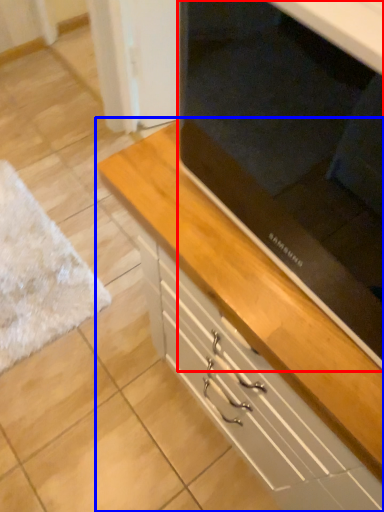
Question: Among these objects, which one is farthest to the camera, appliance (highlighted by a red box) or chest of drawers (highlighted by a blue box)?

Choices:
 (A) appliance
 (B) chest of drawers

Answer: (B)